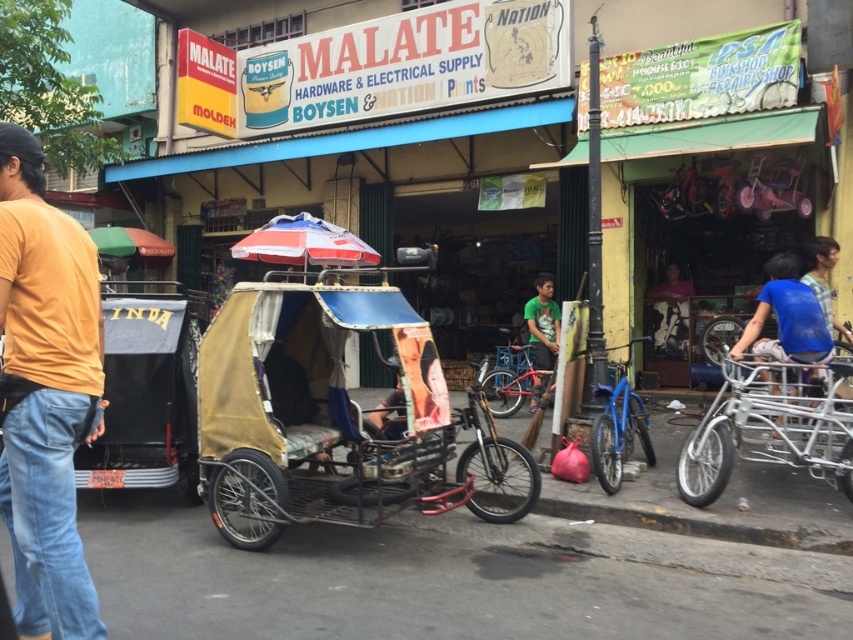
You are a street vendor who needs to place a new stand between the yellow cotton shirt at left and the silver metallic cart at right. Which side should you place it on to ensure there is enough space?

The silver metallic cart at right is wider than the yellow cotton shirt at left, so placing the new stand on the side of the silver metallic cart at right would provide more space.

You are a delivery person who needs to move a 2.5 meter long ladder from the hardware store to a nearby location. The ladder is too long to carry upright. You see the brown fabric tricycle at center and the green matte shirt at center. Can you lay the ladder horizontally between these two objects without bending it?

The distance between the brown fabric tricycle at center and the green matte shirt at center is 4.56 meters. Since the ladder is 2.5 meters long, it can easily be laid horizontally between them without bending.